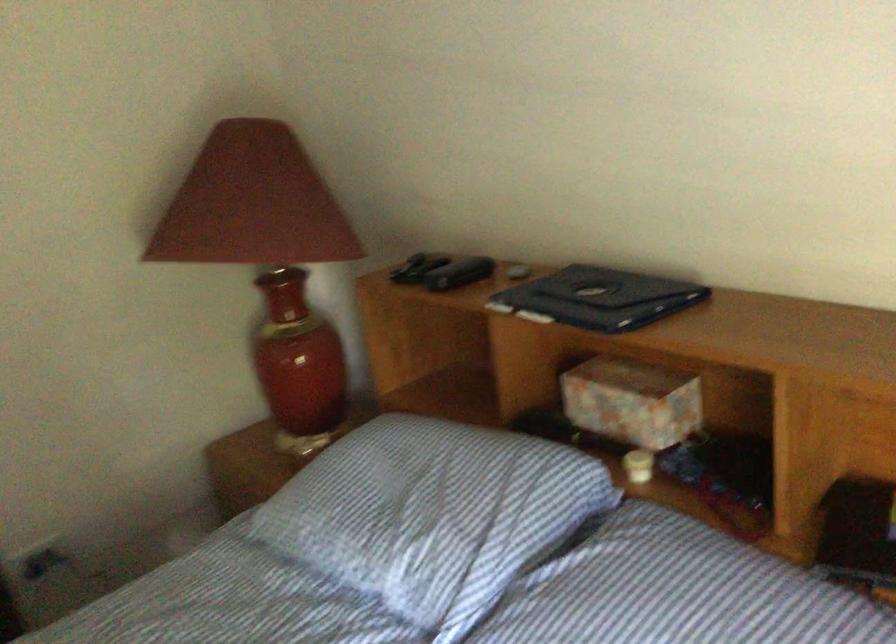
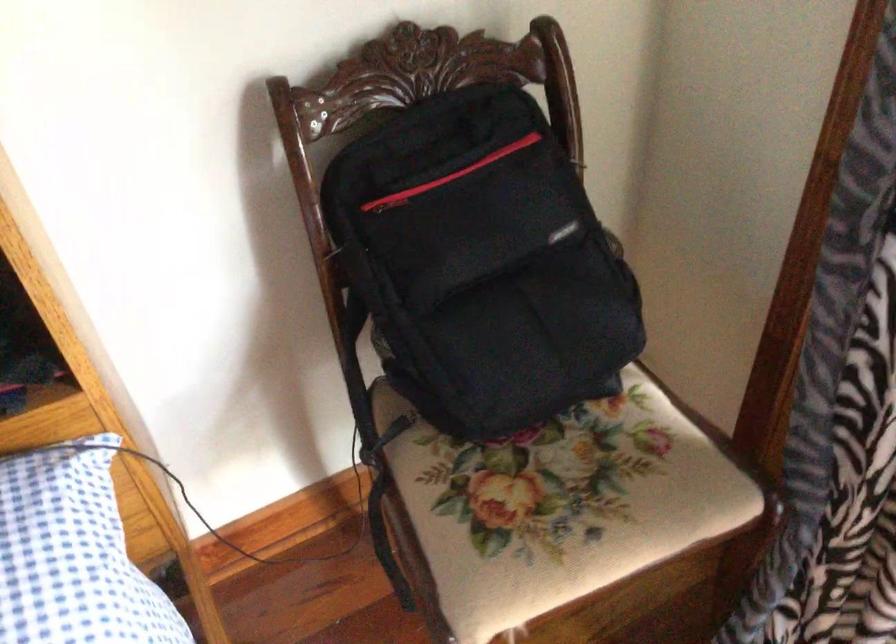
The first image is from the beginning of the video and the second image is from the end. How did the camera likely rotate when shooting the video?

The rotation direction of the camera is right-down.